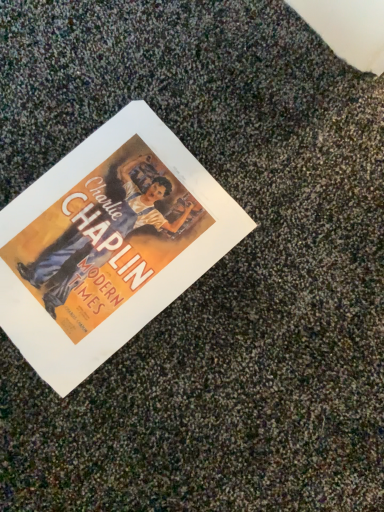
Image resolution: width=384 pixels, height=512 pixels. What do you see at coordinates (108, 244) in the screenshot? I see `matte paper poster at center` at bounding box center [108, 244].

Locate an element on the screen. matte paper poster at center is located at coordinates (108, 244).

This screenshot has width=384, height=512. I want to click on matte paper poster at center, so click(x=108, y=244).